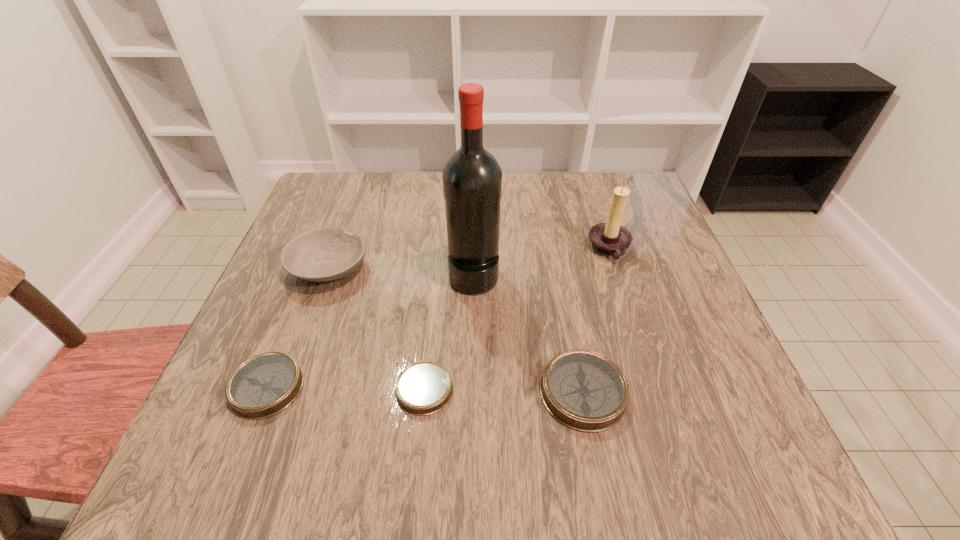
This screenshot has width=960, height=540. What are the coordinates of `the fifth tallest object` in the screenshot? It's located at (264, 385).

Locate an element on the screen. The image size is (960, 540). the leftmost compass is located at coordinates (264, 385).

This screenshot has height=540, width=960. What are the coordinates of `the shortest object` in the screenshot? It's located at pos(423,388).

This screenshot has height=540, width=960. I want to click on the shortest compass, so click(x=423, y=388).

What are the coordinates of `the rightmost compass` in the screenshot? It's located at (584, 390).

I want to click on the tallest compass, so click(x=584, y=390).

I want to click on the tallest object, so click(472, 178).

Identify the location of candle holder. The height and width of the screenshot is (540, 960). (610, 239).

Locate an element on the screen. This screenshot has height=540, width=960. the rightmost object is located at coordinates (610, 239).

The image size is (960, 540). I want to click on the third tallest object, so click(328, 253).